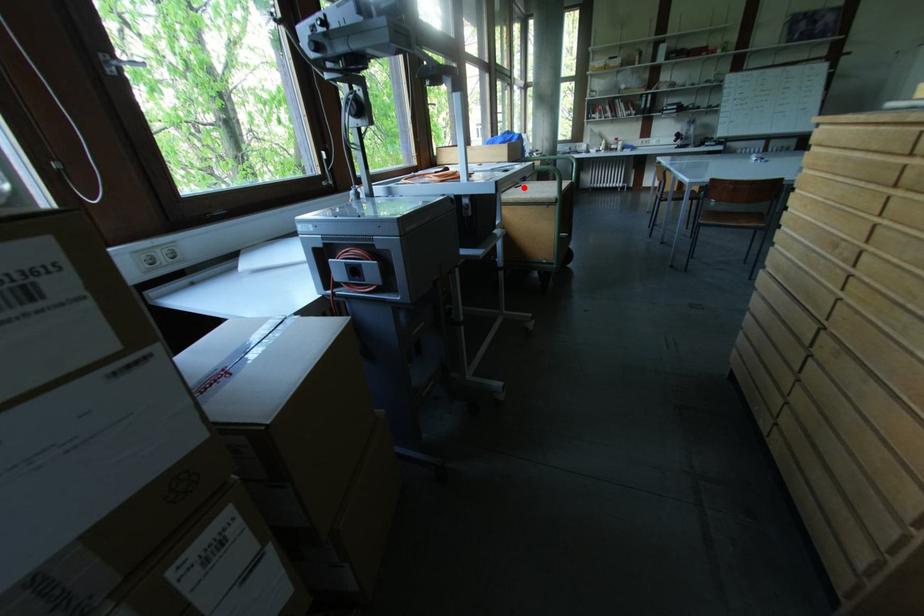
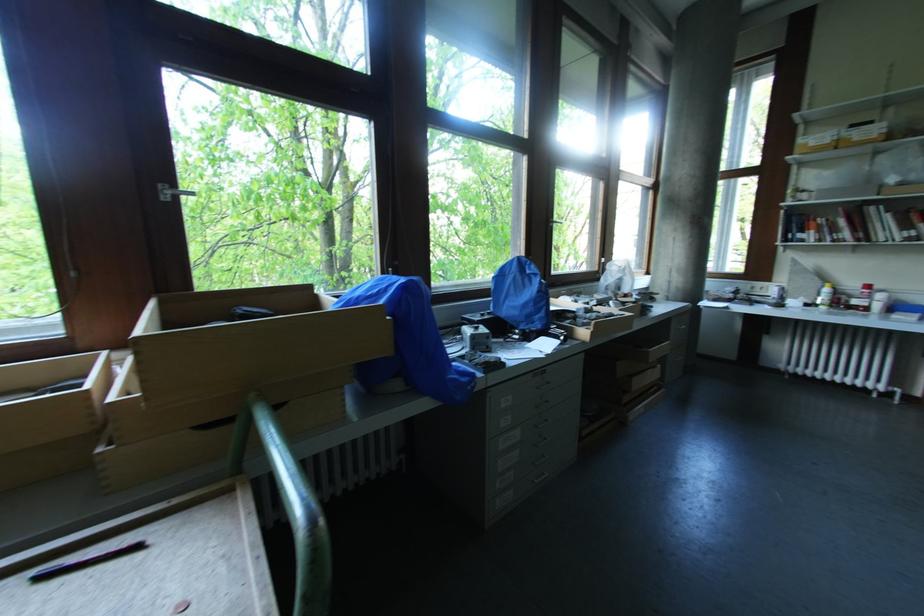
Where in the second image is the point corresponding to the highlighted location from the first image?

(140, 549)